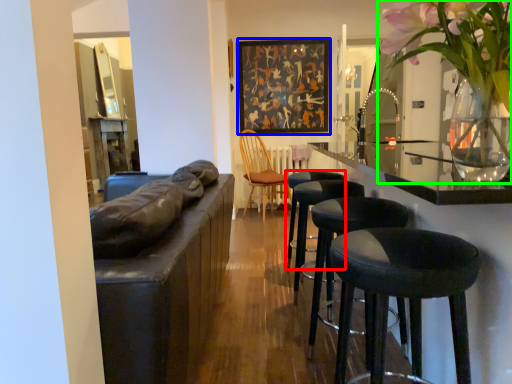
Question: Which is nearer to the stool (highlighted by a red box)? picture frame (highlighted by a blue box) or floral arrangement (highlighted by a green box).

Choices:
 (A) picture frame
 (B) floral arrangement

Answer: (B)